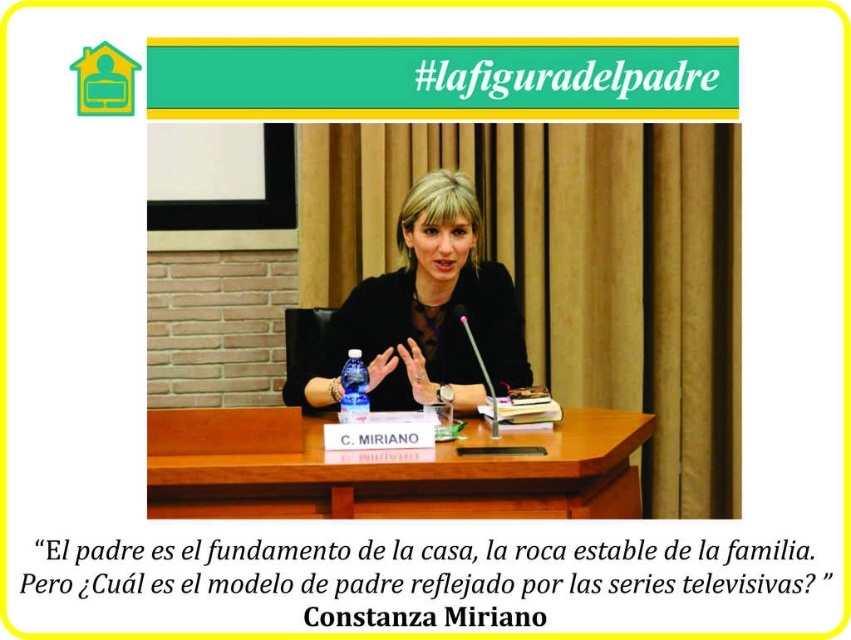
You are standing in the room and want to take a photo of the scene. If you focus your camera on point [470,513], will point [461,246] also be in focus?

Point [470,513] is closer to the camera than point [461,246]. Therefore, if you focus on point [470,513], point [461,246] may not be in focus because it is further away.